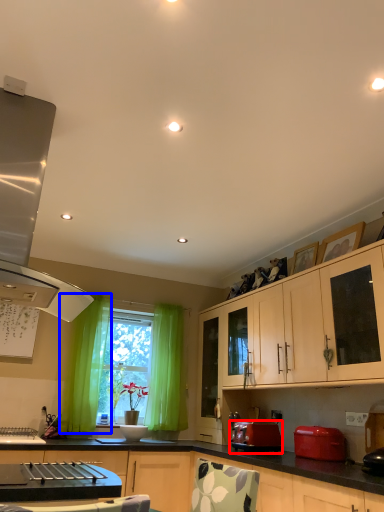
Question: Which point is further to the camera, toaster (highlighted by a red box) or curtain (highlighted by a blue box)?

Choices:
 (A) toaster
 (B) curtain

Answer: (B)